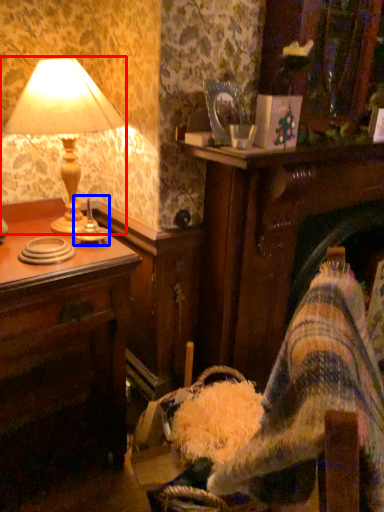
Question: Which of the following is the farthest to the observer, lamp (highlighted by a red box) or candle holder (highlighted by a blue box)?

Choices:
 (A) lamp
 (B) candle holder

Answer: (B)